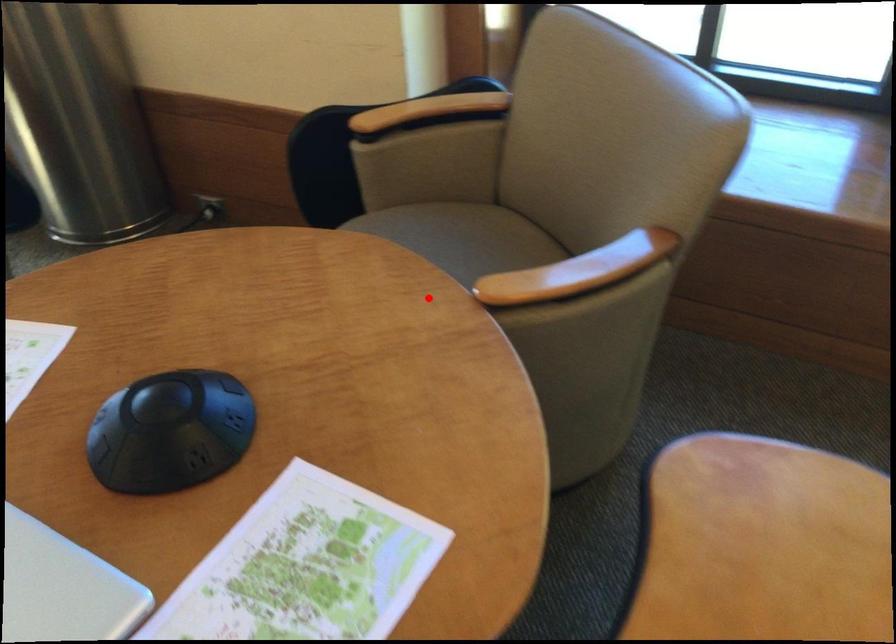
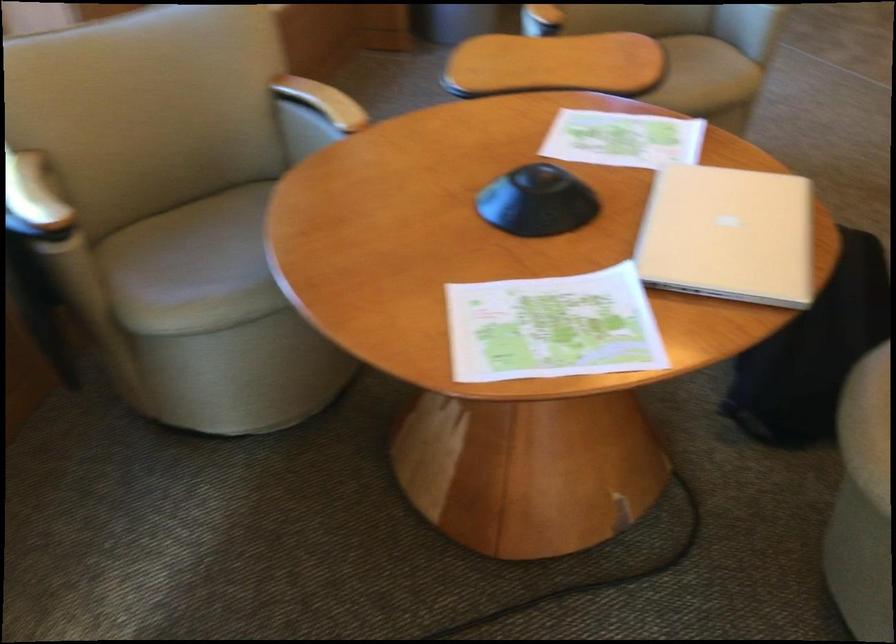
Question: I am providing you with two images of the same scene from different viewpoints. In image1, a red point is highlighted. Considering the same 3D point in image2, which of the following is correct?

Choices:
 (A) It is closer
 (B) It is farther

Answer: (B)